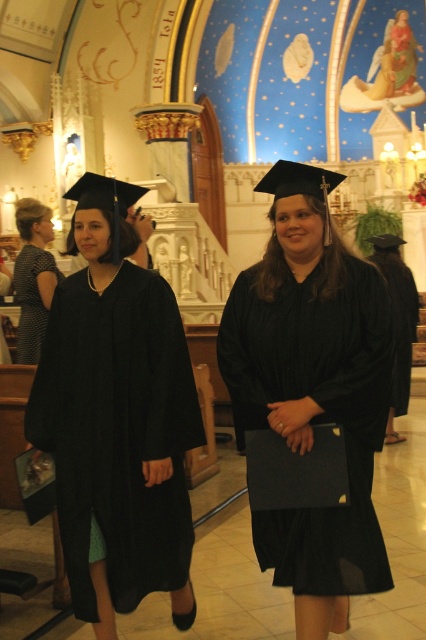
You are a photographer standing at the back of the church during a graduation ceremony. You need to capture a photo of both the matte black gown at center and the matte black dress at left without any obstruction. Based on their positions, can you position yourself so that both are fully visible in the frame?

The matte black gown at center is in front of the matte black dress at left, so positioning yourself to the side where the gown is not blocking the dress would allow both to be visible. Ensure the camera angle captures both subjects without the gown obscuring the dress.

You are standing at the entrance of the church and want to hand a diploma to the person wearing the matte black gown at center. Based on their position in the image, can you determine if they are facing towards you or away from you?

The matte black gown at center is located at point (x=117, y=419), which indicates their position relative to the entrance. Since the person is positioned at the center and holding a diploma folder under their arm, they are likely facing away from the entrance, meaning they are not facing towards you.

You are a photographer standing at the back of the church during a graduation ceremony. You need to take a photo that includes both the matte black graduation gown at center and the matte black dress at left. Based on their sizes, which one should you focus on to ensure both fit in the frame without cropping?

The matte black graduation gown at center is smaller in size compared to the matte black dress at left. To ensure both fit in the frame without cropping, focus on the larger matte black dress at left since it requires more space, allowing the smaller gown to also be included.